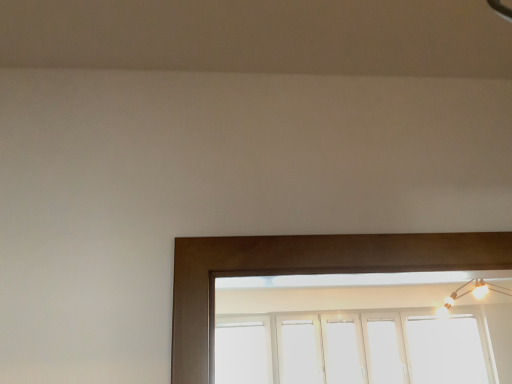
This screenshot has width=512, height=384. What are the coordinates of `white plastic window at center` in the screenshot? It's located at click(355, 349).

Describe the element at coordinates (355, 349) in the screenshot. Image resolution: width=512 pixels, height=384 pixels. I see `white plastic window at center` at that location.

In order to click on white plastic window at center in this screenshot , I will do pyautogui.click(x=355, y=349).